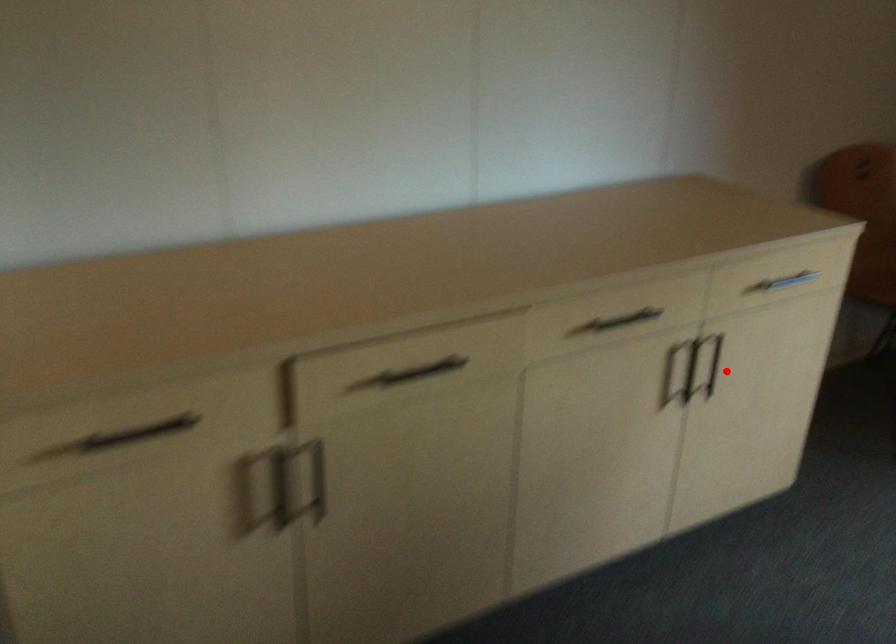
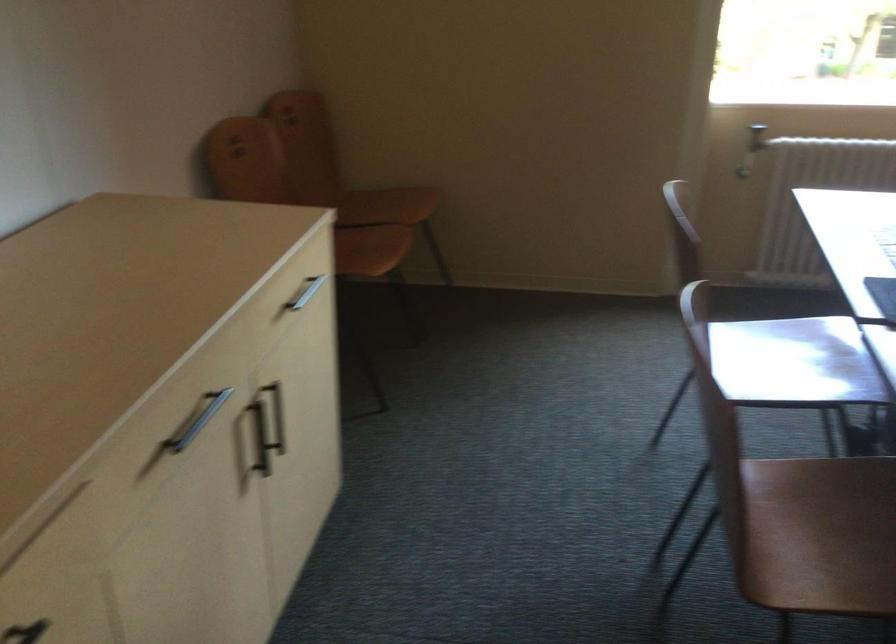
In the second image, find the point that corresponds to the highlighted location in the first image.

(277, 415)